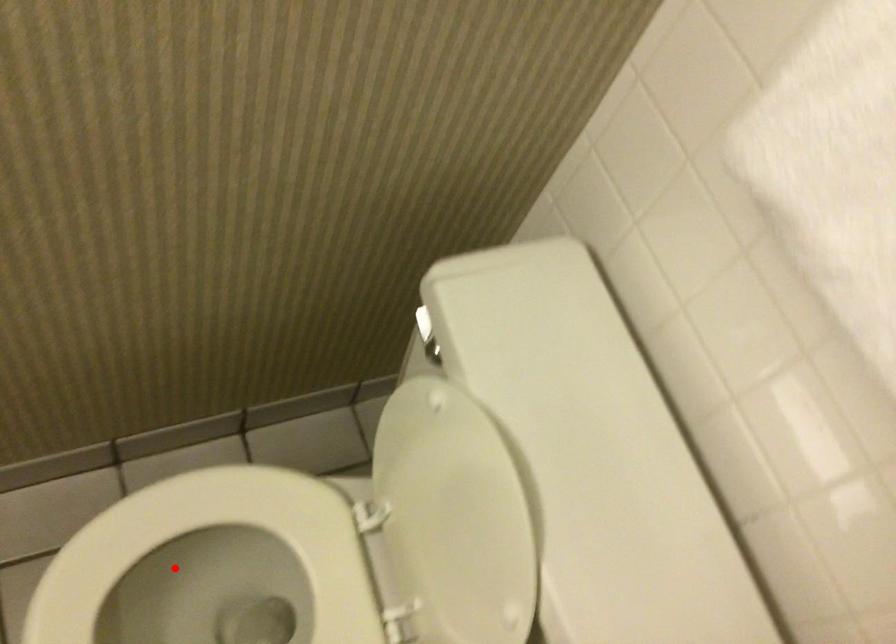
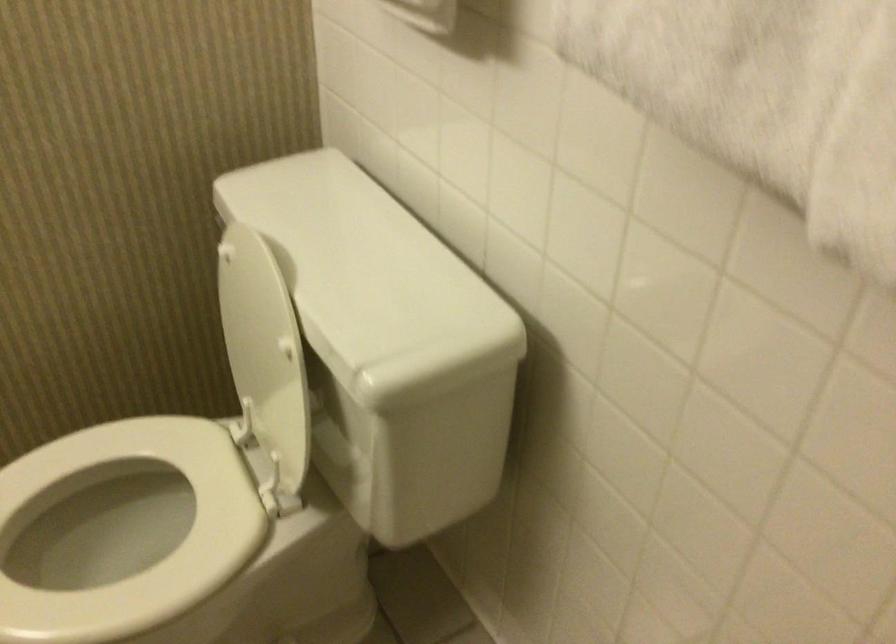
Locate, in the second image, the point that corresponds to the highlighted location in the first image.

(97, 545)